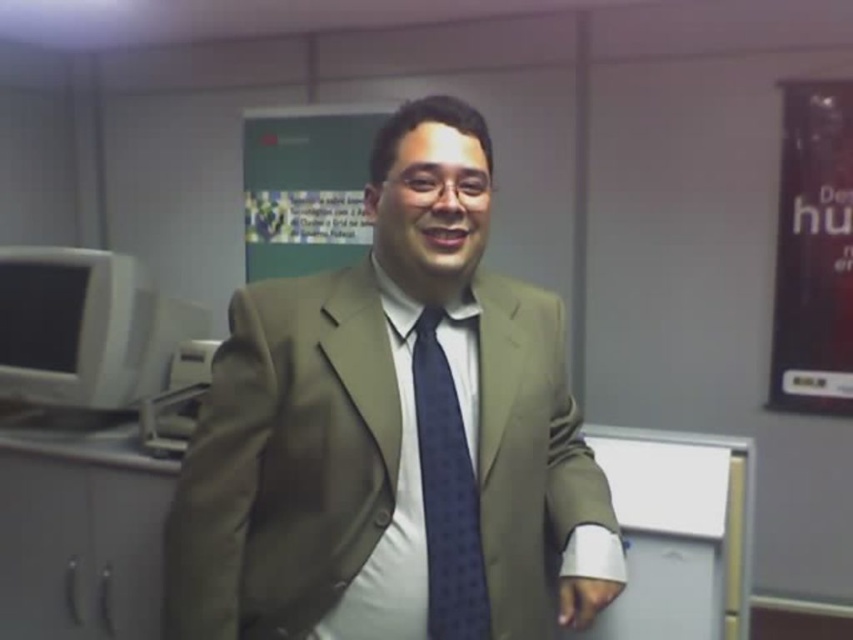
Question: Is white matte bulletin board at center thinner than blue dotted fabric tie at center?

Choices:
 (A) yes
 (B) no

Answer: (B)

Question: Which point appears farthest from the camera in this image?

Choices:
 (A) (695, 506)
 (B) (361, 173)

Answer: (B)

Question: Among these objects, which one is nearest to the camera?

Choices:
 (A) matte gray monitor at left
 (B) white matte bulletin board at center
 (C) matte plastic sign at upper center

Answer: (B)

Question: Does matte gray monitor at left appear on the left side of blue dotted fabric tie at center?

Choices:
 (A) yes
 (B) no

Answer: (A)

Question: Which point is farther to the camera?

Choices:
 (A) matte plastic sign at upper center
 (B) white matte bulletin board at center
 (C) matte gray monitor at left

Answer: (A)

Question: Is matte brown suit at center thinner than matte plastic sign at upper center?

Choices:
 (A) yes
 (B) no

Answer: (A)